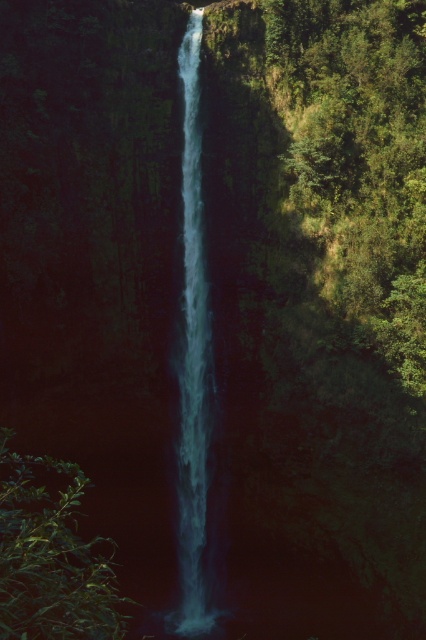
Can you confirm if green leafy vegetation at right is bigger than clear blue water at center?

Yes, green leafy vegetation at right is bigger than clear blue water at center.

The image size is (426, 640). Describe the element at coordinates (359, 160) in the screenshot. I see `green leafy vegetation at right` at that location.

What do you see at coordinates (359, 160) in the screenshot?
I see `green leafy vegetation at right` at bounding box center [359, 160].

You are a GUI agent. You are given a task and a screenshot of the screen. Output one action in this format:
    pyautogui.click(x=<x>, y=<y>)
    Task: Click on the green leafy vegetation at right
    
    Given the screenshot: What is the action you would take?
    pyautogui.click(x=359, y=160)

What do you see at coordinates (359, 160) in the screenshot? I see `green leafy vegetation at right` at bounding box center [359, 160].

Does green leafy vegetation at right appear on the right side of green leafy bush at lower left?

Yes, green leafy vegetation at right is to the right of green leafy bush at lower left.

The height and width of the screenshot is (640, 426). Describe the element at coordinates (359, 160) in the screenshot. I see `green leafy vegetation at right` at that location.

Where is `green leafy vegetation at right`? This screenshot has height=640, width=426. green leafy vegetation at right is located at coordinates (359, 160).

Does green leafy bush at lower left have a greater height compared to clear blue water at center?

No, green leafy bush at lower left is not taller than clear blue water at center.

Does green leafy bush at lower left have a smaller size compared to clear blue water at center?

No.

Between point (25, 504) and point (189, 445), which one is positioned behind?

The point (189, 445) is more distant.

You are a GUI agent. You are given a task and a screenshot of the screen. Output one action in this format:
    pyautogui.click(x=<x>, y=<y>)
    Task: Click on the green leafy bush at lower left
    This screenshot has width=426, height=640.
    Given the screenshot: What is the action you would take?
    pyautogui.click(x=49, y=557)